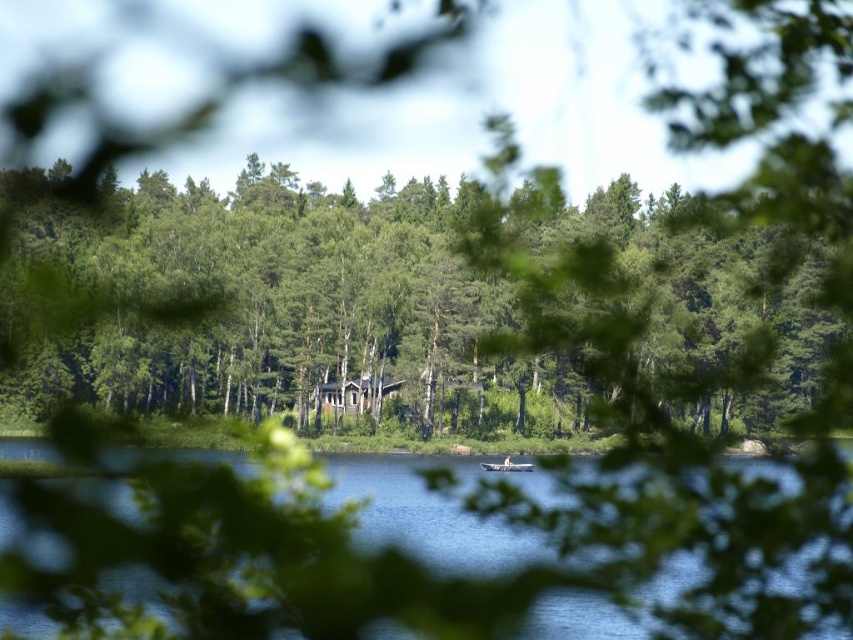
Question: Based on their relative distances, which object is nearer to the blue water at center?

Choices:
 (A) wooden boat at center
 (B) green leafy trees at center

Answer: (A)

Question: Is green leafy trees at center above blue water at center?

Choices:
 (A) yes
 (B) no

Answer: (A)

Question: Does green leafy trees at center have a greater width compared to blue water at center?

Choices:
 (A) yes
 (B) no

Answer: (A)

Question: Which object is positioned closest to the green leafy trees at center?

Choices:
 (A) blue water at center
 (B) wooden boat at center

Answer: (A)

Question: Which point is closer to the camera?

Choices:
 (A) (486, 468)
 (B) (570, 632)

Answer: (B)

Question: Is green leafy trees at center closer to camera compared to wooden boat at center?

Choices:
 (A) yes
 (B) no

Answer: (B)